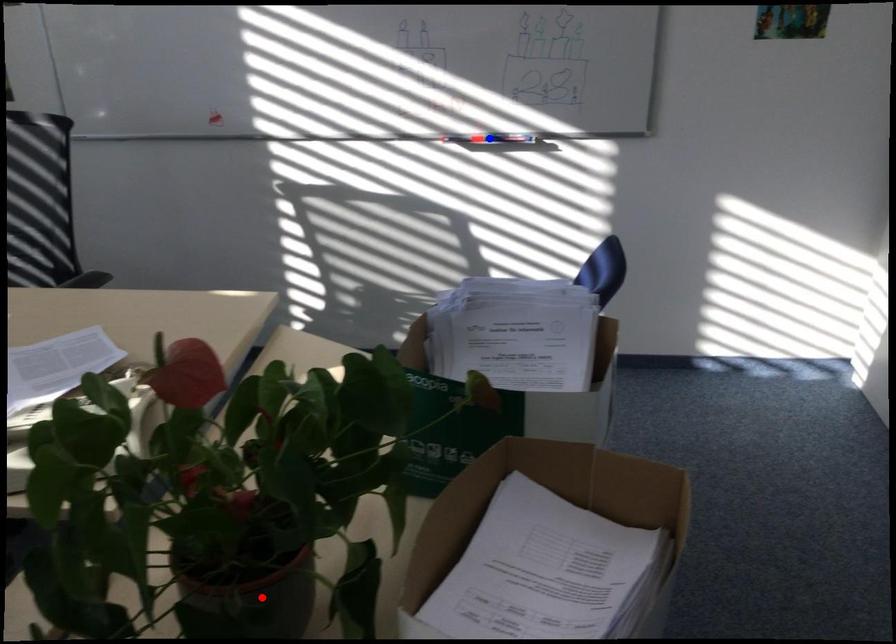
Question: Two points are marked on the image. Which point is closer to the camera?

Choices:
 (A) Blue point is closer.
 (B) Red point is closer.

Answer: (B)